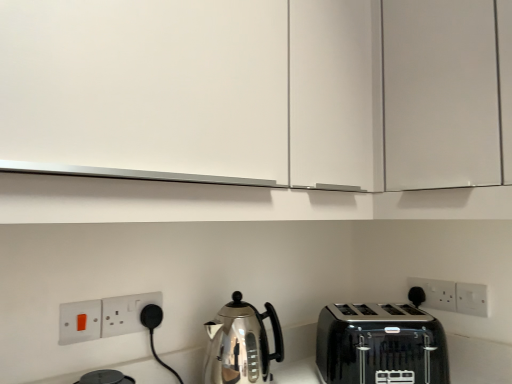
Identify the location of polished stainless steel kettle at center. (241, 344).

Measure the distance between point (63, 338) and camera.

Point (63, 338) and camera are 35.00 inches apart from each other.

At what (x,y) coordinates should I click in order to perform the action: click on matte white switch at lower left, which is the fourth electric outlet from back to front. Please return your answer as a coordinate pair (x, y). Looking at the image, I should click on (79, 321).

The height and width of the screenshot is (384, 512). Find the location of `white plastic electrical outlet at lower right, which ranks as the second electric outlet in right-to-left order`. white plastic electrical outlet at lower right, which ranks as the second electric outlet in right-to-left order is located at coordinates (436, 293).

What do you see at coordinates (436, 293) in the screenshot? I see `white plastic electrical outlet at lower right, which ranks as the second electric outlet in right-to-left order` at bounding box center [436, 293].

Where is `white plastic socket at lower center, the 3th electric outlet positioned from the right`? Image resolution: width=512 pixels, height=384 pixels. white plastic socket at lower center, the 3th electric outlet positioned from the right is located at coordinates (126, 313).

Locate an element on the screen. The width and height of the screenshot is (512, 384). polished stainless steel kettle at center is located at coordinates (241, 344).

Which object is further away from the camera, black glossy toaster at lower right or white matte cabinet at upper center?

black glossy toaster at lower right is further away from the camera.

Between black glossy toaster at lower right and white matte cabinet at upper center, which one has more height?

With more height is white matte cabinet at upper center.

Can white matte cabinet at upper center be found inside black glossy toaster at lower right?

No, white matte cabinet at upper center is not inside black glossy toaster at lower right.

Can you confirm if black glossy toaster at lower right is thinner than white matte cabinet at upper center?

Yes.

Considering the sizes of objects white matte cabinet at upper center and white plastic socket at lower center, positioned as the 3th electric outlet in back-to-front order, in the image provided, who is bigger, white matte cabinet at upper center or white plastic socket at lower center, positioned as the 3th electric outlet in back-to-front order,?

white matte cabinet at upper center is bigger.

Is white matte cabinet at upper center to the left or to the right of white plastic socket at lower center, which ranks as the 2th electric outlet in front-to-back order, in the image?

In the image, white matte cabinet at upper center appears on the right side of white plastic socket at lower center, which ranks as the 2th electric outlet in front-to-back order.

This screenshot has width=512, height=384. I want to click on the 2nd electric outlet behind when counting from the white matte cabinet at upper center, so click(126, 313).

Is white matte cabinet at upper center behind white plastic socket at lower center, which ranks as the 2th electric outlet in front-to-back order?

That is False.

This screenshot has height=384, width=512. Identify the location of kettle on the right of white matte cabinet at upper center. (241, 344).

In the scene shown: Which is more to the left, polished stainless steel kettle at center or white matte cabinet at upper center?

Positioned to the left is white matte cabinet at upper center.

From a real-world perspective, between polished stainless steel kettle at center and white matte cabinet at upper center, who is vertically lower?

polished stainless steel kettle at center.

From a real-world perspective, which object stands above the other?

matte white switch at lower left, which is the fourth electric outlet from back to front, is physically above.

Considering the relative sizes of matte white switch at lower left, the fourth electric outlet positioned from the right, and white plastic electrical outlet at lower right, which appears as the 4th electric outlet when viewed from the front, in the image provided, is matte white switch at lower left, the fourth electric outlet positioned from the right, smaller than white plastic electrical outlet at lower right, which appears as the 4th electric outlet when viewed from the front,?

Correct, matte white switch at lower left, the fourth electric outlet positioned from the right, occupies less space than white plastic electrical outlet at lower right, which appears as the 4th electric outlet when viewed from the front.

From the image's perspective, which one is positioned higher, matte white switch at lower left, which is the fourth electric outlet from back to front, or white plastic electrical outlet at lower right, which appears as the 4th electric outlet when viewed from the front?

From the image's view, matte white switch at lower left, which is the fourth electric outlet from back to front, is above.

Looking at this image, can you confirm if matte white switch at lower left, marked as the first electric outlet in a front-to-back arrangement, is thinner than white plastic electrical outlet at lower right, which ranks as the second electric outlet in right-to-left order?

No.

Is matte white switch at lower left, the fourth electric outlet positioned from the right, facing away from polished stainless steel kettle at center?

No, matte white switch at lower left, the fourth electric outlet positioned from the right,'s orientation is not away from polished stainless steel kettle at center.

Is point (75, 307) closer or farther from the camera than point (251, 327)?

Point (75, 307) appears to be closer to the viewer than point (251, 327).

Based on the photo, which of these two, matte white switch at lower left, which is the fourth electric outlet from back to front, or polished stainless steel kettle at center, is smaller?

matte white switch at lower left, which is the fourth electric outlet from back to front.

Is matte white switch at lower left, positioned as the first electric outlet in left-to-right order, beside polished stainless steel kettle at center?

No, matte white switch at lower left, positioned as the first electric outlet in left-to-right order, is not with polished stainless steel kettle at center.

Does point (106, 331) come behind point (268, 349)?

No, it is in front of (268, 349).

In the image, is white plastic socket at lower center, positioned as the 3th electric outlet in back-to-front order, on the left side or the right side of polished stainless steel kettle at center?

Based on their positions, white plastic socket at lower center, positioned as the 3th electric outlet in back-to-front order, is located to the left of polished stainless steel kettle at center.

This screenshot has width=512, height=384. I want to click on the 3rd electric outlet above the polished stainless steel kettle at center (from the image's perspective), so click(126, 313).

From a real-world perspective, is white plastic socket at lower center, positioned as the 3th electric outlet in back-to-front order, below polished stainless steel kettle at center?

No.

Is black glossy toaster at lower right smaller than white plastic electrical outlet at lower right, which appears as the 4th electric outlet when viewed from the front?

No, black glossy toaster at lower right is not smaller than white plastic electrical outlet at lower right, which appears as the 4th electric outlet when viewed from the front.

Is point (393, 314) farther from camera compared to point (420, 285)?

Yes, it is behind point (420, 285).

Between black glossy toaster at lower right and white plastic electrical outlet at lower right, which ranks as the second electric outlet in right-to-left order, which one has larger width?

Wider between the two is black glossy toaster at lower right.

Is black glossy toaster at lower right in front of or behind white plastic electrical outlet at lower right, which ranks as the second electric outlet in right-to-left order, in the image?

In the image, black glossy toaster at lower right appears in front of white plastic electrical outlet at lower right, which ranks as the second electric outlet in right-to-left order.

Where is `toaster behind the white matte cabinet at upper center`? toaster behind the white matte cabinet at upper center is located at coordinates (380, 345).

Where is `cabinetry above the white plastic socket at lower center, positioned as the 3th electric outlet in back-to-front order (from a real-world perspective)`? This screenshot has height=384, width=512. cabinetry above the white plastic socket at lower center, positioned as the 3th electric outlet in back-to-front order (from a real-world perspective) is located at coordinates (260, 92).

Estimate the real-world distances between objects in this image. Which object is further from white plastic electric outlet at right, which appears as the 3th electric outlet when viewed from the front, black glossy toaster at lower right or white plastic socket at lower center, the 3th electric outlet positioned from the right?

white plastic socket at lower center, the 3th electric outlet positioned from the right, lies further to white plastic electric outlet at right, which appears as the 3th electric outlet when viewed from the front, than the other object.

When comparing their distances from white plastic socket at lower center, positioned as the 3th electric outlet in back-to-front order, does polished stainless steel kettle at center or white plastic electrical outlet at lower right, which appears as the 4th electric outlet when viewed from the front, seem further?

white plastic electrical outlet at lower right, which appears as the 4th electric outlet when viewed from the front, is further to white plastic socket at lower center, positioned as the 3th electric outlet in back-to-front order.

Which object lies nearer to the anchor point white matte cabinet at upper center, white plastic electrical outlet at lower right, which appears as the 4th electric outlet when viewed from the front, or polished stainless steel kettle at center?

polished stainless steel kettle at center lies closer to white matte cabinet at upper center than the other object.

From the image, which object appears to be nearer to white matte cabinet at upper center, white plastic electric outlet at right, which is counted as the first electric outlet, starting from the right, or white plastic electrical outlet at lower right, the third electric outlet positioned from the left?

white plastic electrical outlet at lower right, the third electric outlet positioned from the left, is closer to white matte cabinet at upper center.

Looking at the image, which one is located further to polished stainless steel kettle at center, white plastic electrical outlet at lower right, the third electric outlet positioned from the left, or black glossy toaster at lower right?

Based on the image, white plastic electrical outlet at lower right, the third electric outlet positioned from the left, appears to be further to polished stainless steel kettle at center.

Which object lies nearer to the anchor point white plastic socket at lower center, which ranks as the 2th electric outlet in front-to-back order, white plastic electrical outlet at lower right, which appears as the 4th electric outlet when viewed from the front, or black glossy toaster at lower right?

Based on the image, black glossy toaster at lower right appears to be nearer to white plastic socket at lower center, which ranks as the 2th electric outlet in front-to-back order.

Based on their spatial positions, is white plastic socket at lower center, positioned as the 3th electric outlet in back-to-front order, or white plastic electrical outlet at lower right, the first electric outlet when ordered from back to front, closer to black glossy toaster at lower right?

The object closer to black glossy toaster at lower right is white plastic electrical outlet at lower right, the first electric outlet when ordered from back to front.

Consider the image. Looking at the image, which one is located further to black glossy toaster at lower right, white matte cabinet at upper center or polished stainless steel kettle at center?

white matte cabinet at upper center.

Identify the location of kettle between white plastic socket at lower center, positioned as the 3th electric outlet in back-to-front order, and black glossy toaster at lower right from left to right. (241, 344).

Identify the location of toaster between polished stainless steel kettle at center and white plastic electrical outlet at lower right, which appears as the 4th electric outlet when viewed from the front, in the horizontal direction. The width and height of the screenshot is (512, 384). (380, 345).

Identify the location of kettle situated between white plastic socket at lower center, positioned as the 3th electric outlet in back-to-front order, and white plastic electrical outlet at lower right, which appears as the 4th electric outlet when viewed from the front, from left to right. (241, 344).

Locate an element on the screen. The height and width of the screenshot is (384, 512). kettle between matte white switch at lower left, marked as the first electric outlet in a front-to-back arrangement, and white plastic electric outlet at right, which appears as the 3th electric outlet when viewed from the front, from left to right is located at coordinates (241, 344).